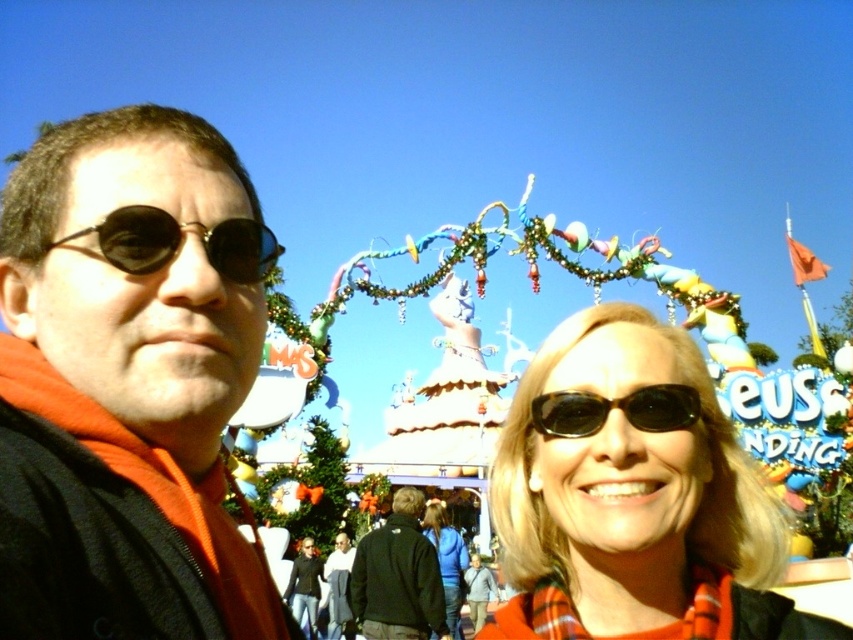
Question: Which object is farther from the camera taking this photo?

Choices:
 (A) dark blue jacket at center
 (B) blue fabric jacket at center
 (C) decorative plastic archway at center
 (D) matte black sunglasses at left

Answer: (B)

Question: Does decorative plastic archway at center have a lesser width compared to blue fabric jacket at center?

Choices:
 (A) yes
 (B) no

Answer: (B)

Question: In this image, where is decorative plastic archway at center located relative to black matte sunglasses at left?

Choices:
 (A) right
 (B) left

Answer: (A)

Question: Based on their relative distances, which object is farther from the black matte sunglasses at left?

Choices:
 (A) black plastic sunglasses at center
 (B) dark blue jacket at center
 (C) matte black sunglasses at left
 (D) blue fabric jacket at center

Answer: (D)

Question: Does dark blue jacket at center appear over dark gray jacket at center?

Choices:
 (A) yes
 (B) no

Answer: (B)

Question: Which object appears farthest from the camera in this image?

Choices:
 (A) black matte sunglasses at left
 (B) plaid scarf at center
 (C) matte black sunglasses at left
 (D) dark blue jacket at center

Answer: (D)